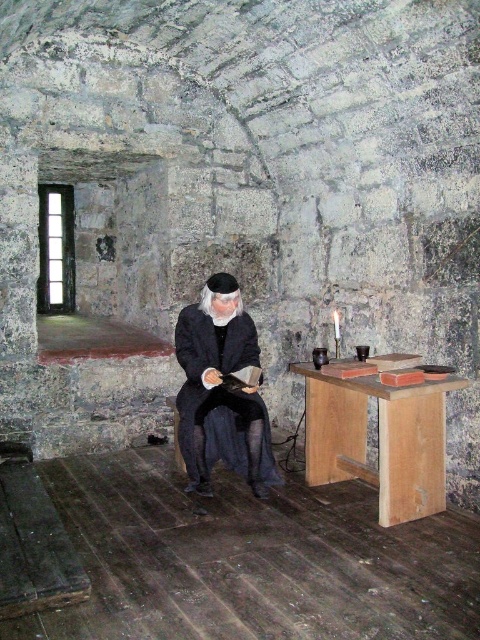
You are standing in the medieval study and need to place a candlestick on the wooden table at center. However, there is a dark woolen robe at center in the way. To reach the table, should you move to the left or right of the robe?

The wooden table at center is positioned on the right side of the dark woolen robe at center, so you should move to the right of the robe to reach the table.

You are standing in the middle of the room and want to place a candle on the wooden table at center. Can you walk straight ahead to reach it?

The wooden table at center is located at point (379, 440), which means it is not directly in front of you if you are standing in the middle of the room. You would need to adjust your direction slightly to reach it.